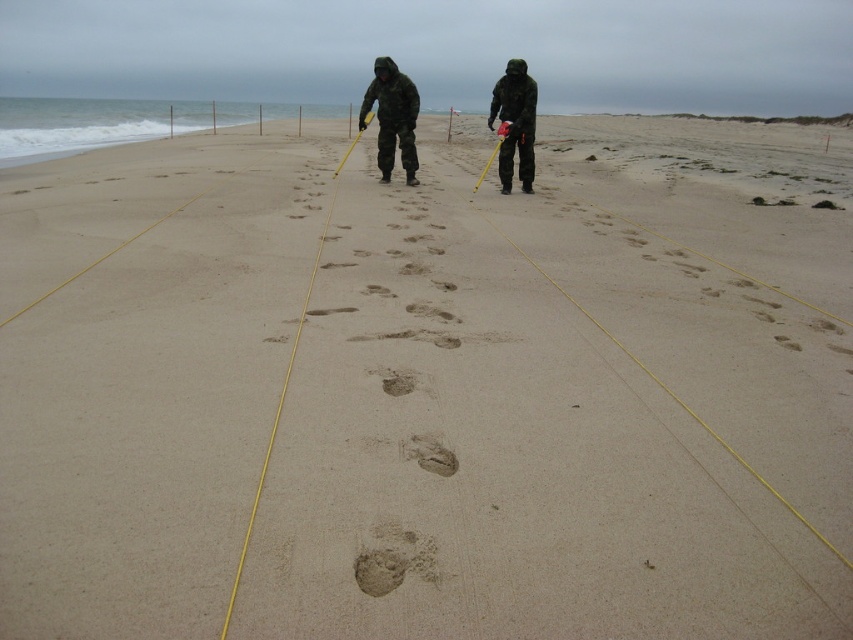
Does camouflage fabric jacket at center have a larger size compared to brown sandy footprint at center?

Correct, camouflage fabric jacket at center is larger in size than brown sandy footprint at center.

Is camouflage fabric jacket at center shorter than brown sandy footprint at center?

Incorrect, camouflage fabric jacket at center's height does not fall short of brown sandy footprint at center's.

Measure the distance between camouflage fabric jacket at center and camera.

A distance of 30.12 feet exists between camouflage fabric jacket at center and camera.

The image size is (853, 640). What are the coordinates of `camouflage fabric jacket at center` in the screenshot? It's located at (392, 116).

Is camouflage fabric jacket at center in front of camouflage fabric person at center?

No, camouflage fabric jacket at center is further to the viewer.

Which is below, camouflage fabric jacket at center or camouflage fabric person at center?

Result: Positioned lower is camouflage fabric person at center.

Is point (390, 74) farther from viewer compared to point (515, 131)?

Yes, point (390, 74) is behind point (515, 131).

Where is `camouflage fabric jacket at center`? The height and width of the screenshot is (640, 853). camouflage fabric jacket at center is located at coordinates (392, 116).

Is camouflage fabric person at center closer to the viewer compared to brown sandy footprint at center?

No.

Based on the photo, is camouflage fabric person at center wider than brown sandy footprint at center?

Indeed, camouflage fabric person at center has a greater width compared to brown sandy footprint at center.

Does point (531, 163) lie in front of point (442, 454)?

No, it is not.

I want to click on camouflage fabric person at center, so click(515, 122).